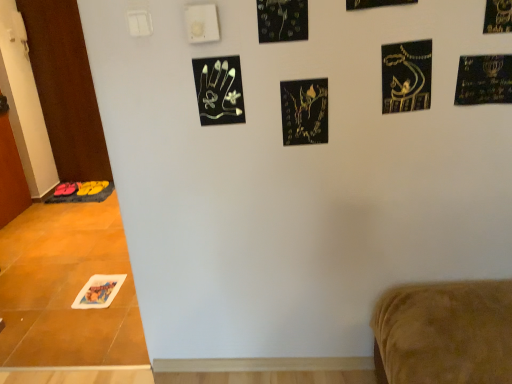
Question: Considering the positions of point click(x=510, y=74) and point click(x=236, y=59), is point click(x=510, y=74) closer or farther from the camera than point click(x=236, y=59)?

Choices:
 (A) closer
 (B) farther

Answer: (A)

Question: Visually, is gold metallic menorah at upper right positioned to the left or to the right of black metallic handprint at upper center, which is counted as the third print, starting from the back?

Choices:
 (A) left
 (B) right

Answer: (B)

Question: Which object is the closest to the gold metallic menorah at upper right?

Choices:
 (A) black metallic handprint at upper center, the third print ordered from the bottom
 (B) brown wood door at left, placed as the first door when sorted from back to front
 (C) gold metallic calligraphy at upper right, which is counted as the third print, starting from the top
 (D) black matte print at center, the third print when ordered from right to left
 (E) black matte print at upper right, the 1th print from the right

Answer: (E)

Question: Estimate the real-world distances between objects in this image. Which object is farther from the gold metallic menorah at upper right?

Choices:
 (A) black metallic handprint at upper center, the 2th print from the left
 (B) black matte print at upper right, which appears as the sixth print when ordered from the bottom
 (C) black glossy leaves at upper center, placed as the 5th print when sorted from back to front
 (D) white glossy door at left, the first door viewed from the front
 (E) black matte print at center, placed as the second print when sorted from back to front

Answer: (D)